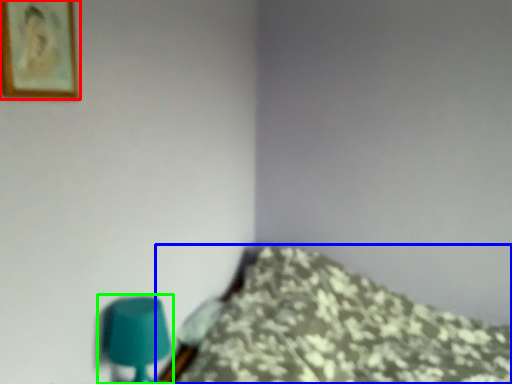
Question: Which object is the closest to the picture frame (highlighted by a red box)? Choose among these: furniture (highlighted by a blue box) or table lamp (highlighted by a green box).

Choices:
 (A) furniture
 (B) table lamp

Answer: (B)